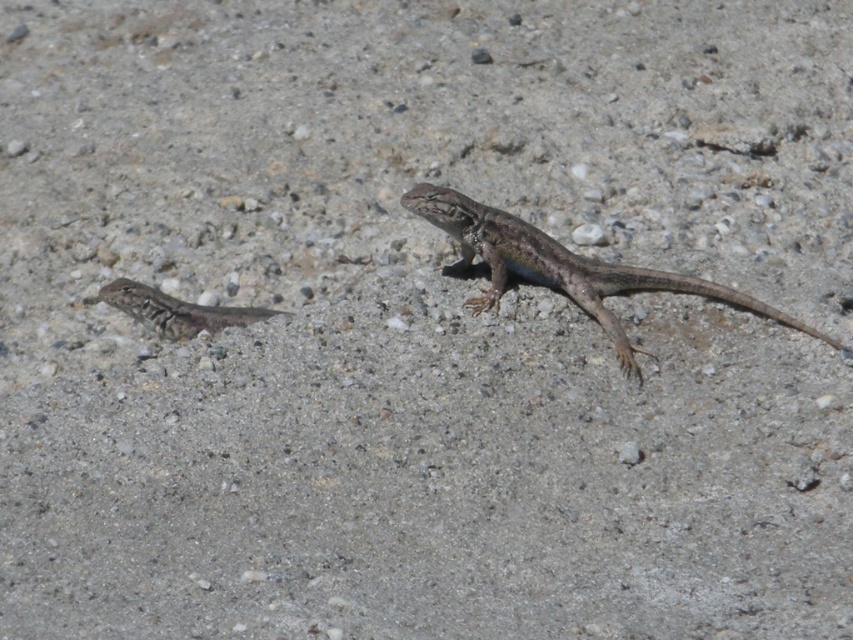
Is point (630, 269) positioned behind point (155, 332)?

That is False.

I want to click on speckled brown lizard at center, so click(561, 266).

Is point (479, 221) closer to camera compared to point (245, 308)?

That is True.

This screenshot has width=853, height=640. What are the coordinates of `speckled brown lizard at center` in the screenshot? It's located at (561, 266).